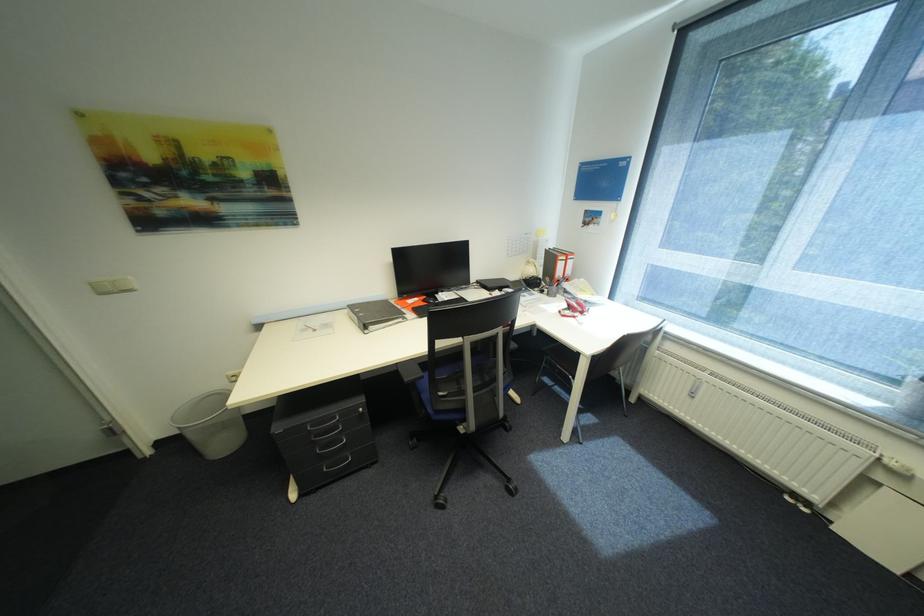
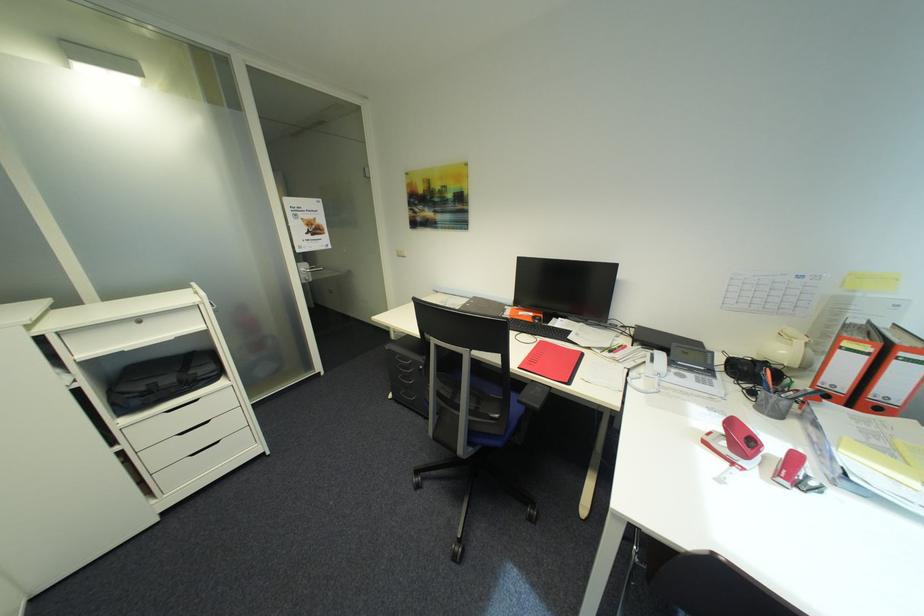
Locate, in the second image, the point that corresponds to [582,317] in the first image.

(742, 464)